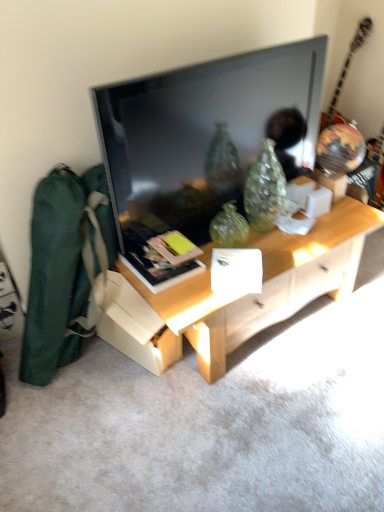
Question: Is flat screen tv at center shorter than light wood desk at center?

Choices:
 (A) no
 (B) yes

Answer: (A)

Question: From the image's perspective, would you say flat screen tv at center is shown under light wood desk at center?

Choices:
 (A) no
 (B) yes

Answer: (A)

Question: Is flat screen tv at center oriented away from light wood desk at center?

Choices:
 (A) yes
 (B) no

Answer: (B)

Question: Is flat screen tv at center at the right side of light wood desk at center?

Choices:
 (A) no
 (B) yes

Answer: (A)

Question: Considering the relative sizes of flat screen tv at center and light wood desk at center in the image provided, is flat screen tv at center bigger than light wood desk at center?

Choices:
 (A) no
 (B) yes

Answer: (A)

Question: Is flat screen tv at center bigger or smaller than glossy wood guitar at upper right?

Choices:
 (A) small
 (B) big

Answer: (A)

Question: Does point (278, 74) appear closer or farther from the camera than point (359, 40)?

Choices:
 (A) farther
 (B) closer

Answer: (B)

Question: Is flat screen tv at center taller or shorter than glossy wood guitar at upper right?

Choices:
 (A) tall
 (B) short

Answer: (B)

Question: From a real-world perspective, relative to glossy wood guitar at upper right, is flat screen tv at center vertically above or below?

Choices:
 (A) above
 (B) below

Answer: (A)

Question: Based on their positions, is matte black book at center located to the left or right of green canvas messenger bag at left?

Choices:
 (A) right
 (B) left

Answer: (A)

Question: From their relative heights in the image, would you say matte black book at center is taller or shorter than green canvas messenger bag at left?

Choices:
 (A) short
 (B) tall

Answer: (A)

Question: Based on their sizes in the image, would you say matte black book at center is bigger or smaller than green canvas messenger bag at left?

Choices:
 (A) big
 (B) small

Answer: (B)

Question: From the image's perspective, is matte black book at center positioned above or below green canvas messenger bag at left?

Choices:
 (A) below
 (B) above

Answer: (B)

Question: Is matte black book at center situated inside glossy wood guitar at upper right or outside?

Choices:
 (A) outside
 (B) inside

Answer: (A)

Question: From the image's perspective, relative to glossy wood guitar at upper right, is matte black book at center above or below?

Choices:
 (A) above
 (B) below

Answer: (B)